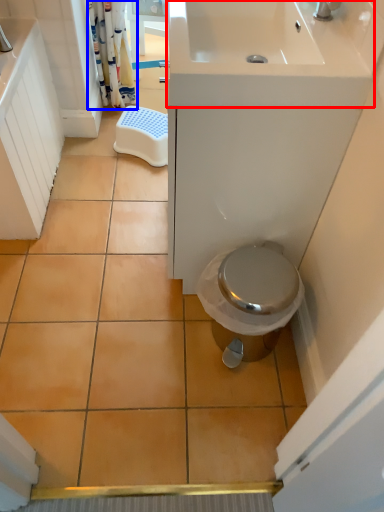
Question: Which of the following is the farthest to the observer, sink (highlighted by a red box) or shower curtain (highlighted by a blue box)?

Choices:
 (A) sink
 (B) shower curtain

Answer: (B)